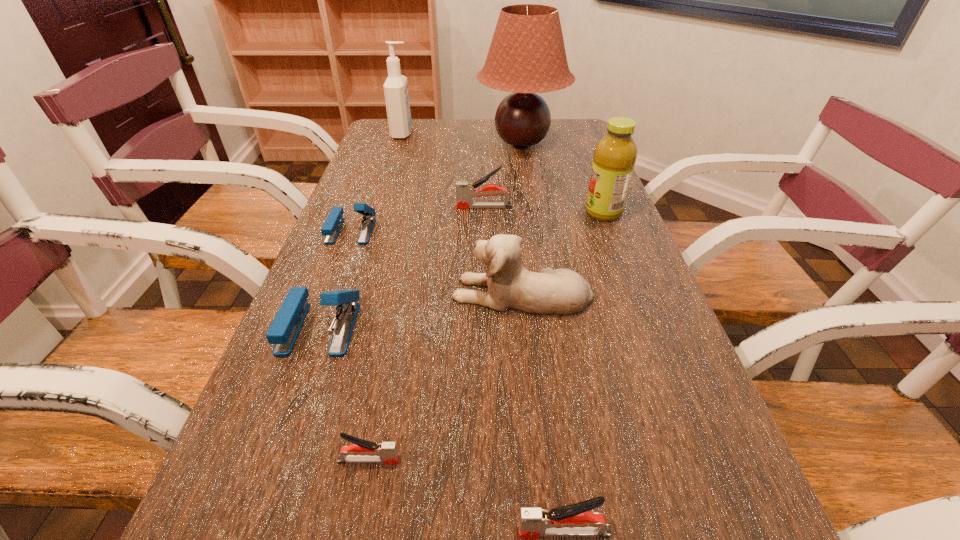
Locate an element on the screen. Image resolution: width=960 pixels, height=540 pixels. cleansing agent at the left edge is located at coordinates (396, 93).

This screenshot has height=540, width=960. In order to click on lampshade located at the right edge in this screenshot , I will do `click(527, 55)`.

You are a GUI agent. You are given a task and a screenshot of the screen. Output one action in this format:
    pyautogui.click(x=<x>, y=<y>)
    Task: Click on the fruit juice that is positioned at the right edge
    The width and height of the screenshot is (960, 540).
    Given the screenshot: What is the action you would take?
    pyautogui.click(x=615, y=155)

Locate an element on the screen. puppy at the right edge is located at coordinates (510, 285).

The height and width of the screenshot is (540, 960). I want to click on object at the far left corner, so click(396, 93).

I want to click on object positioned at the far right corner, so click(x=527, y=55).

The image size is (960, 540). What are the coordinates of `vacant area at the far edge` in the screenshot? It's located at (446, 122).

You are a GUI agent. You are given a task and a screenshot of the screen. Output one action in this format:
    pyautogui.click(x=<x>, y=<y>)
    Task: Click on the free spot at the left edge of the desktop
    Image resolution: width=960 pixels, height=540 pixels.
    Given the screenshot: What is the action you would take?
    pyautogui.click(x=378, y=268)

You are a GUI agent. You are given a task and a screenshot of the screen. Output one action in this format:
    pyautogui.click(x=<x>, y=<y>)
    Task: Click on the free region at the right edge of the desktop
    
    Given the screenshot: What is the action you would take?
    pyautogui.click(x=582, y=160)

Locate an element on the screen. This screenshot has height=540, width=960. free space between the shortest stapler and the biggest gray stapler is located at coordinates (426, 334).